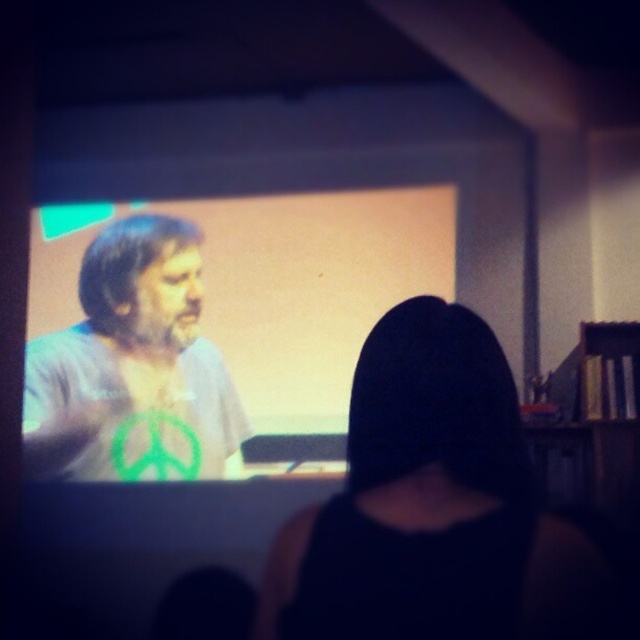
Which is above, black matte hair at center or green fabric shirt at center?

green fabric shirt at center is above.

The image size is (640, 640). I want to click on black matte hair at center, so click(x=432, y=504).

Find the location of a particular element. black matte hair at center is located at coordinates (432, 504).

Locate an element on the screen. The image size is (640, 640). black matte hair at center is located at coordinates (432, 504).